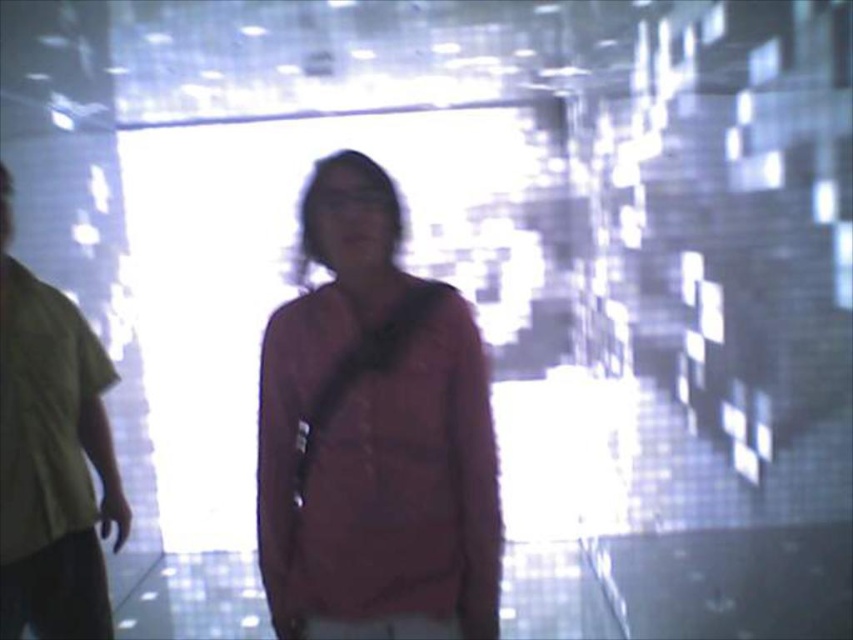
You are a fashion designer observing two shirts in an image. You see a matte red shirt at center and a green fabric shirt at left. Which shirt has a shorter length?

The matte red shirt at center is shorter than the green fabric shirt at left.

You are navigating through a crowded indoor space and need to reach a specific location. You see two points marked as point (340, 212) and point (67, 616). Which point should you head towards if you want to move closer to the foreground?

Point (340, 212) is in front of point (67, 616), so you should head towards point (340, 212) to move closer to the foreground.